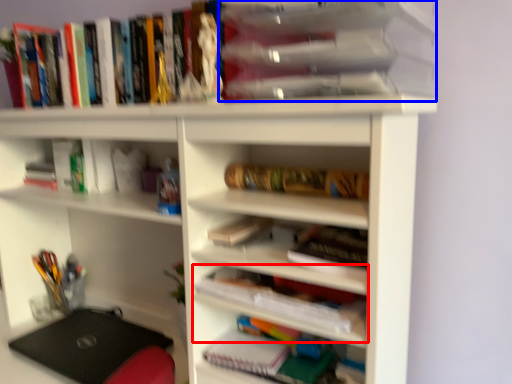
Question: Which object appears farthest to the camera in this image, book (highlighted by a red box) or book (highlighted by a blue box)?

Choices:
 (A) book
 (B) book

Answer: (A)